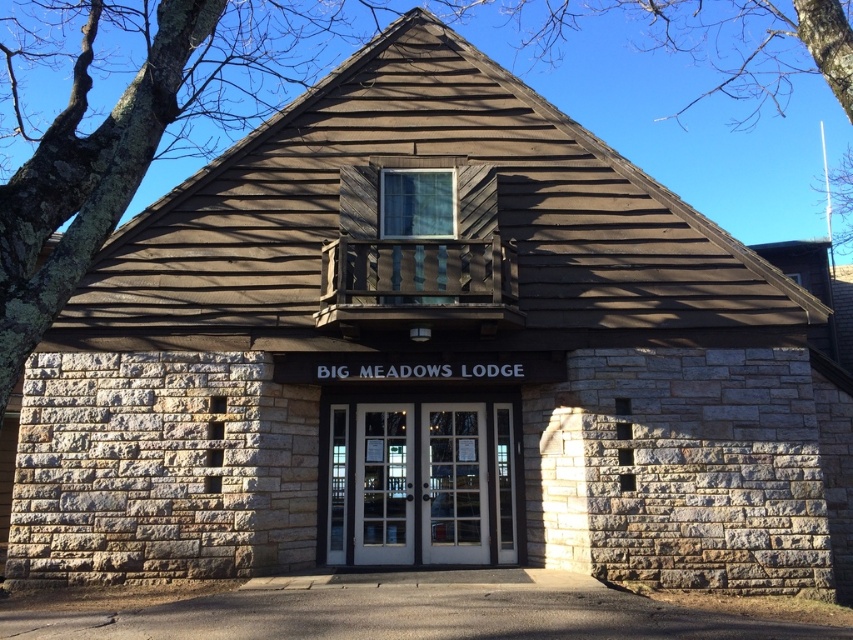
Does brown wood tree at upper center come in front of white glass door at center?

Yes, brown wood tree at upper center is closer to the viewer.

Who is more forward, (x=653, y=60) or (x=514, y=476)?

Point (x=514, y=476)

Is point (842, 42) farther from camera compared to point (347, 465)?

That is False.

Where is `brown wood tree at upper center`? brown wood tree at upper center is located at coordinates (686, 52).